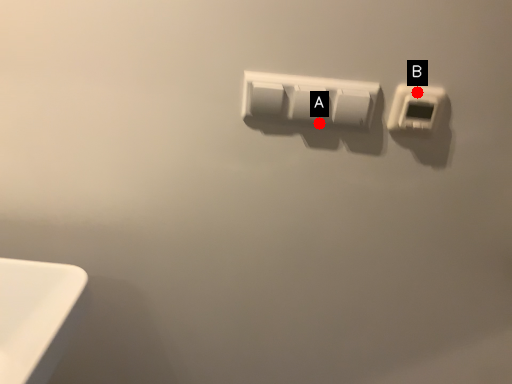
Question: Two points are circled on the image, labeled by A and B beside each circle. Which point is closer to the camera taking this photo?

Choices:
 (A) A is closer
 (B) B is closer

Answer: (B)